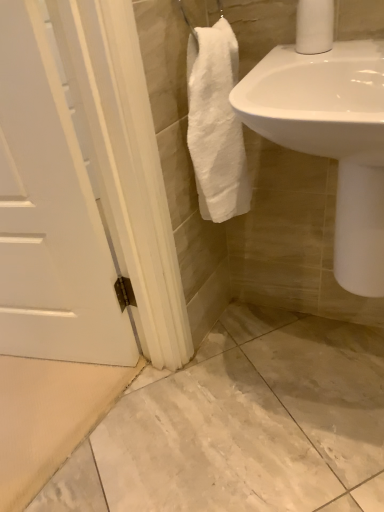
Question: From the image's perspective, is white matte toilet paper at upper right below white glossy sink at upper right?

Choices:
 (A) no
 (B) yes

Answer: (A)

Question: Is white matte toilet paper at upper right further to the viewer compared to white glossy sink at upper right?

Choices:
 (A) yes
 (B) no

Answer: (A)

Question: Is white matte toilet paper at upper right turned away from white glossy sink at upper right?

Choices:
 (A) yes
 (B) no

Answer: (B)

Question: Does white matte toilet paper at upper right have a greater height compared to white glossy sink at upper right?

Choices:
 (A) no
 (B) yes

Answer: (A)

Question: Is white matte toilet paper at upper right bigger than white glossy sink at upper right?

Choices:
 (A) yes
 (B) no

Answer: (B)

Question: From a real-world perspective, is white matte toilet paper at upper right on white glossy sink at upper right?

Choices:
 (A) no
 (B) yes

Answer: (B)

Question: From a real-world perspective, is white glossy sink at upper right located higher than white matte toilet paper at upper right?

Choices:
 (A) yes
 (B) no

Answer: (B)

Question: Is the position of white glossy sink at upper right more distant than that of white matte toilet paper at upper right?

Choices:
 (A) no
 (B) yes

Answer: (A)

Question: Can you confirm if white glossy sink at upper right is bigger than white matte toilet paper at upper right?

Choices:
 (A) no
 (B) yes

Answer: (B)

Question: Is white glossy sink at upper right thinner than white matte toilet paper at upper right?

Choices:
 (A) no
 (B) yes

Answer: (A)

Question: Is white glossy sink at upper right at the left side of white matte toilet paper at upper right?

Choices:
 (A) no
 (B) yes

Answer: (A)

Question: Is white glossy sink at upper right next to white matte toilet paper at upper right and touching it?

Choices:
 (A) yes
 (B) no

Answer: (B)

Question: From a real-world perspective, is white matte toilet paper at upper right above or below white glossy sink at upper right?

Choices:
 (A) below
 (B) above

Answer: (B)